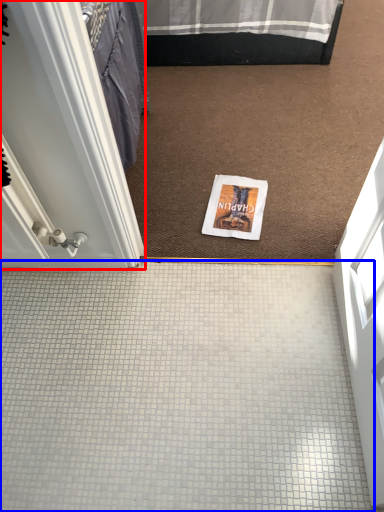
Question: Among these objects, which one is nearest to the camera, door (highlighted by a red box) or plain (highlighted by a blue box)?

Choices:
 (A) door
 (B) plain

Answer: (A)